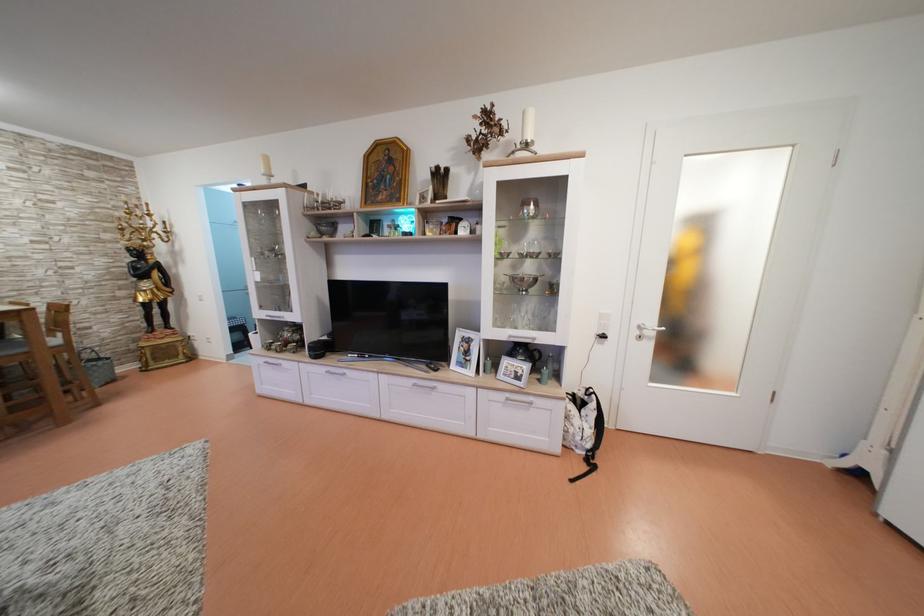
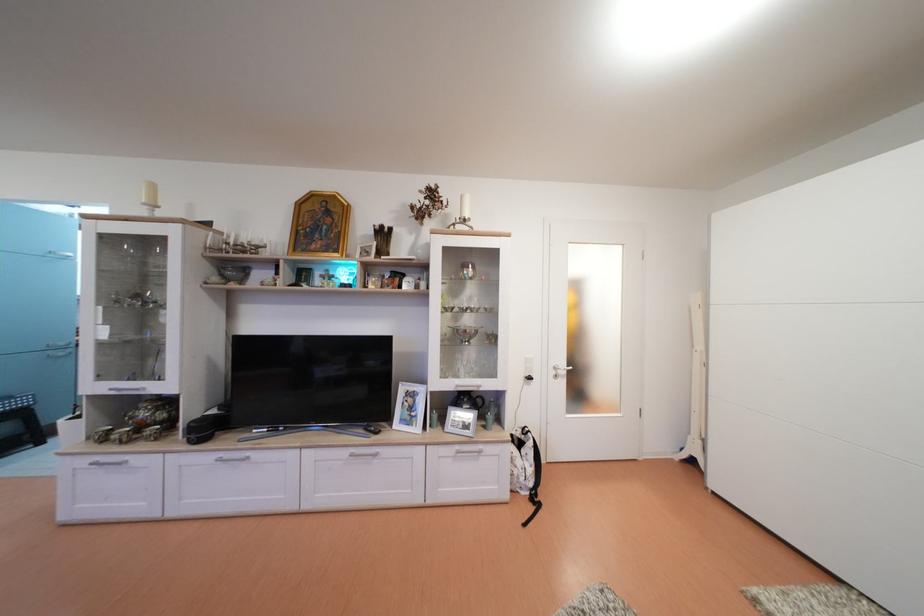
Question: Based on the continuous images, in which direction is the camera rotating? Reply with the corresponding letter.

Choices:
 (A) Left
 (B) Right
 (C) Up
 (D) Down

Answer: (B)